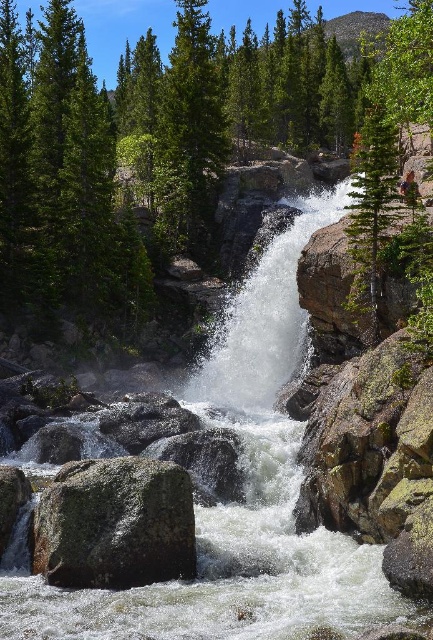
You are standing at the edge of the waterfall and want to reach the green mossy rock at center. Given that the average human walking pace is about 3 feet per second, how many seconds would it take to walk directly to the rock?

The green mossy rock at center is 67.28 feet away from the viewer. At a pace of 3 feet per second, it would take approximately 22.43 seconds to reach it.